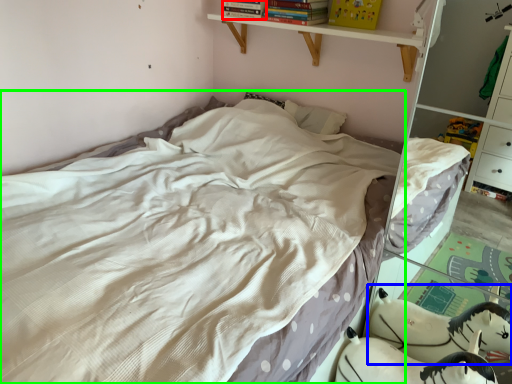
Question: Which is farther away from book (highlighted by a red box)? animal (highlighted by a blue box) or bed (highlighted by a green box)?

Choices:
 (A) animal
 (B) bed

Answer: (A)